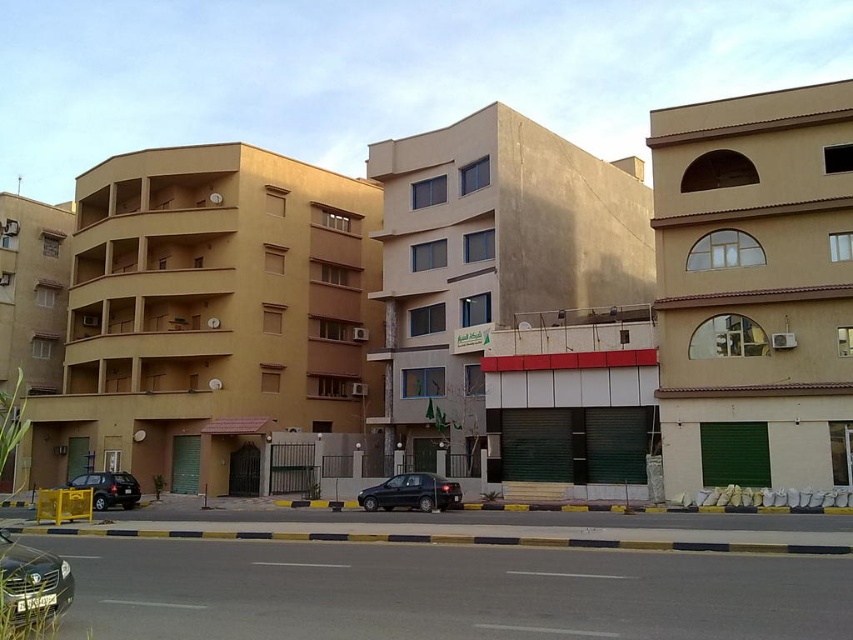
Question: Estimate the real-world distances between objects in this image. Which object is farther from the shiny black sedan at center?

Choices:
 (A) shiny black sedan at lower left
 (B) matte black suv at left

Answer: (A)

Question: Considering the relative positions of shiny black sedan at center and matte black suv at left in the image provided, where is shiny black sedan at center located with respect to matte black suv at left?

Choices:
 (A) left
 (B) right

Answer: (B)

Question: Which object is the closest to the shiny black sedan at center?

Choices:
 (A) matte black suv at left
 (B) shiny black sedan at lower left

Answer: (A)

Question: Is shiny black sedan at center bigger than matte black suv at left?

Choices:
 (A) no
 (B) yes

Answer: (A)

Question: Which object appears farthest from the camera in this image?

Choices:
 (A) matte black suv at left
 (B) shiny black sedan at lower left
 (C) shiny black sedan at center

Answer: (C)

Question: Does shiny black sedan at lower left have a larger size compared to matte black suv at left?

Choices:
 (A) no
 (B) yes

Answer: (A)